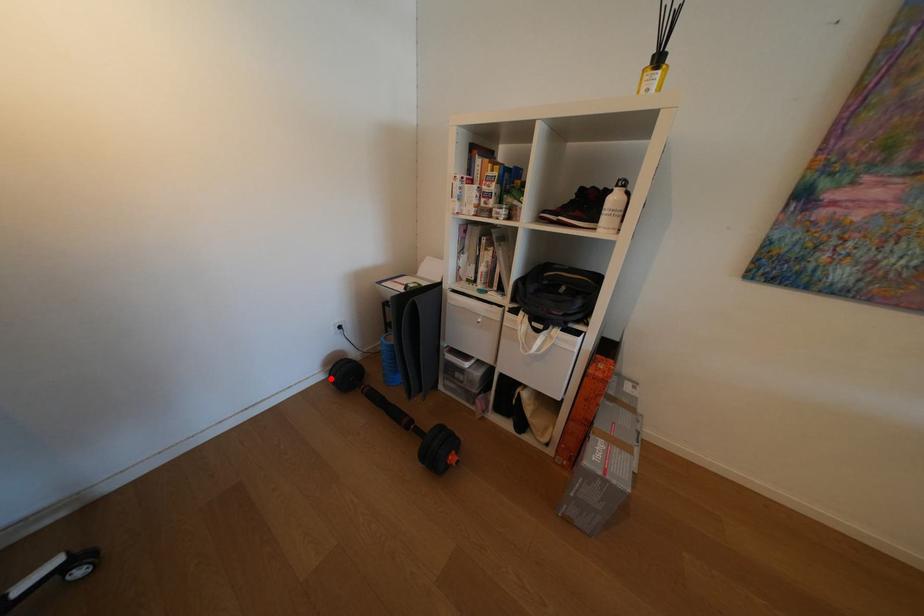
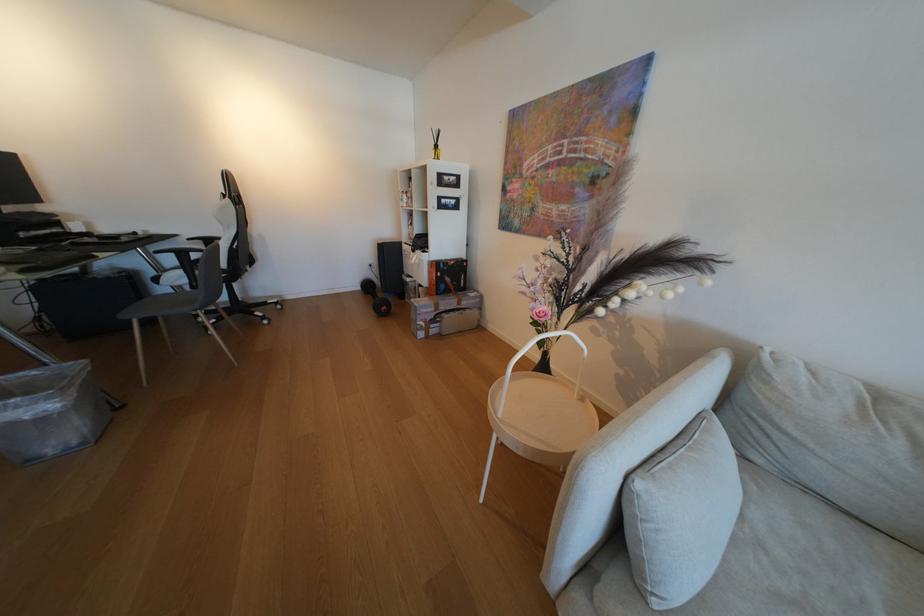
Where in the second image is the point corresponding to the highlighted location from the first image?

(371, 290)